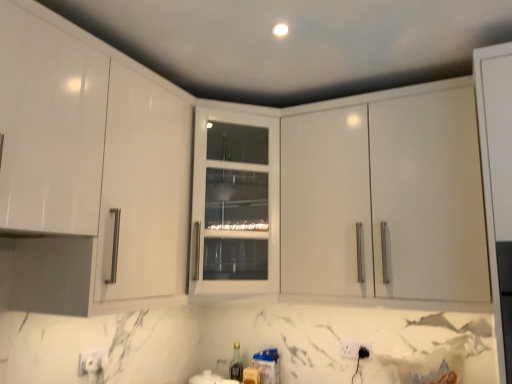
Question: Can you confirm if glossy white cabinet at upper right, marked as the first cabinetry in a right-to-left arrangement, is smaller than white plastic electric outlet at lower center, acting as the 2th electric outlet starting from the back?

Choices:
 (A) yes
 (B) no

Answer: (B)

Question: Is glossy white cabinet at upper right, marked as the first cabinetry in a right-to-left arrangement, looking in the opposite direction of white plastic electric outlet at lower center, arranged as the first electric outlet when viewed from the front?

Choices:
 (A) no
 (B) yes

Answer: (A)

Question: From the image's perspective, is glossy white cabinet at upper right, marked as the first cabinetry in a right-to-left arrangement, above white plastic electric outlet at lower center, arranged as the first electric outlet when viewed from the front?

Choices:
 (A) yes
 (B) no

Answer: (A)

Question: Can you confirm if glossy white cabinet at upper right, marked as the first cabinetry in a right-to-left arrangement, is positioned to the left of white plastic electric outlet at lower center, acting as the 2th electric outlet starting from the back?

Choices:
 (A) yes
 (B) no

Answer: (B)

Question: Are glossy white cabinet at upper right, which ranks as the second cabinetry in left-to-right order, and white plastic electric outlet at lower center, arranged as the first electric outlet when viewed from the front, far apart?

Choices:
 (A) no
 (B) yes

Answer: (A)

Question: Would you say white plastic electric outlet at lower center, acting as the 2th electric outlet starting from the back, is inside or outside white glass cabinet at center, the 2th cabinetry in the right-to-left sequence?

Choices:
 (A) outside
 (B) inside

Answer: (A)

Question: In terms of height, does white plastic electric outlet at lower center, arranged as the first electric outlet when viewed from the front, look taller or shorter compared to white glass cabinet at center, arranged as the first cabinetry when viewed from the left?

Choices:
 (A) tall
 (B) short

Answer: (B)

Question: Is point (357, 352) positioned closer to the camera than point (252, 165)?

Choices:
 (A) closer
 (B) farther

Answer: (B)

Question: Is white plastic electric outlet at lower center, acting as the 2th electric outlet starting from the back, bigger or smaller than white glass cabinet at center, arranged as the first cabinetry when viewed from the left?

Choices:
 (A) small
 (B) big

Answer: (A)

Question: In terms of height, does white plastic electric outlet at lower center, arranged as the first electric outlet when viewed from the front, look taller or shorter compared to glossy white cabinet at upper right, marked as the first cabinetry in a right-to-left arrangement?

Choices:
 (A) short
 (B) tall

Answer: (A)

Question: Considering the positions of white plastic electric outlet at lower center, acting as the 2th electric outlet starting from the back, and glossy white cabinet at upper right, marked as the first cabinetry in a right-to-left arrangement, in the image, is white plastic electric outlet at lower center, acting as the 2th electric outlet starting from the back, wider or thinner than glossy white cabinet at upper right, marked as the first cabinetry in a right-to-left arrangement,?

Choices:
 (A) thin
 (B) wide

Answer: (A)

Question: From a real-world perspective, relative to glossy white cabinet at upper right, which ranks as the second cabinetry in left-to-right order, is white plastic electric outlet at lower center, arranged as the first electric outlet when viewed from the front, vertically above or below?

Choices:
 (A) below
 (B) above

Answer: (A)

Question: Is white plastic electric outlet at lower center, acting as the 2th electric outlet starting from the back, to the left or to the right of glossy white cabinet at upper right, marked as the first cabinetry in a right-to-left arrangement, in the image?

Choices:
 (A) right
 (B) left

Answer: (B)

Question: From a real-world perspective, relative to glossy white cabinet at upper right, marked as the first cabinetry in a right-to-left arrangement, is white plastic electric outlet at lower center, which is the 1th electric outlet from back to front, vertically above or below?

Choices:
 (A) above
 (B) below

Answer: (B)

Question: From the image's perspective, relative to glossy white cabinet at upper right, which ranks as the second cabinetry in left-to-right order, is white plastic electric outlet at lower center, which is the second electric outlet from front to back, above or below?

Choices:
 (A) below
 (B) above

Answer: (A)